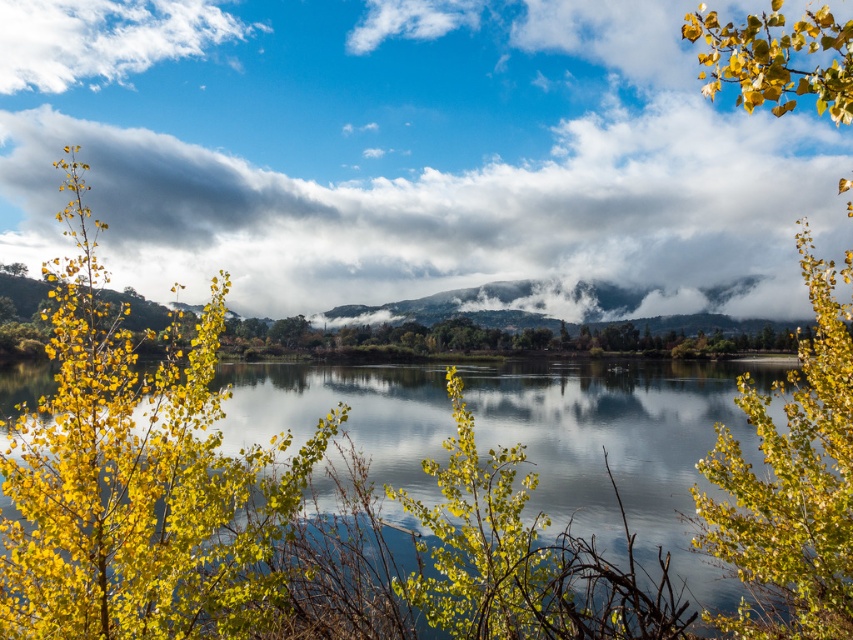
Question: Is cloudy sky at upper center positioned in front of white fluffy cloud at upper left?

Choices:
 (A) yes
 (B) no

Answer: (A)

Question: Is yellow leafy tree at left further to camera compared to white fluffy cloud at upper left?

Choices:
 (A) no
 (B) yes

Answer: (A)

Question: Which point is closer to the camera taking this photo?

Choices:
 (A) click(x=148, y=49)
 (B) click(x=103, y=337)
 (C) click(x=776, y=38)
 (D) click(x=53, y=72)

Answer: (B)

Question: Is yellow leafy tree at left wider than white fluffy cloud at upper left?

Choices:
 (A) no
 (B) yes

Answer: (A)

Question: Which point is closer to the camera?

Choices:
 (A) yellow leafy tree at left
 (B) clear water at center
 (C) white fluffy cloud at upper left

Answer: (A)

Question: Estimate the real-world distances between objects in this image. Which object is farther from the cloudy sky at upper center?

Choices:
 (A) clear water at center
 (B) yellow-green leaves at upper right

Answer: (A)